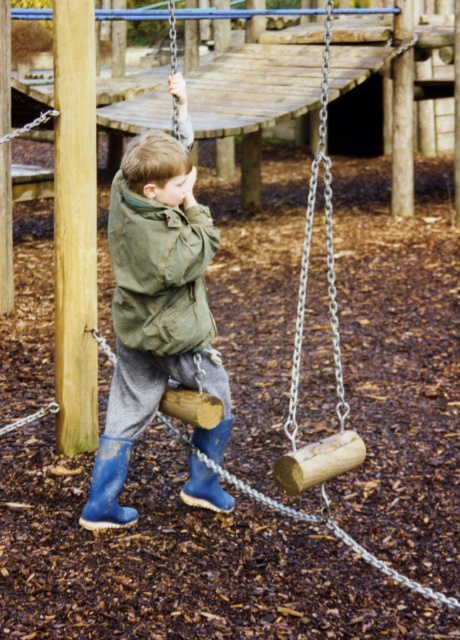
You are a parent supervising a child at the playground. You notice the child is at point (x=155, y=305). What is the child wearing on their upper body?

The child is wearing a matte green jacket at center at point (x=155, y=305).

You are a parent looking at two children playing on the playground. You see a matte green jacket at center and a green canvas jacket at center. Which child is closer to you?

The matte green jacket at center is closer to the viewer than the green canvas jacket at center, so the child wearing the matte green jacket at center is closer to you.